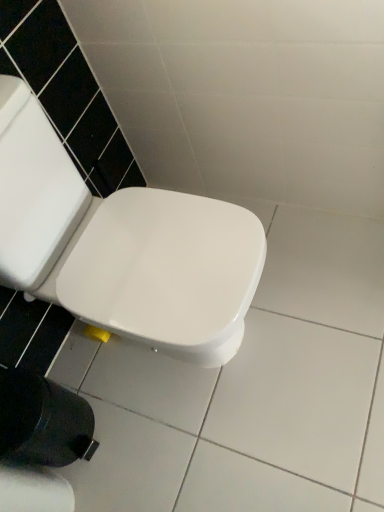
Question: Considering the positions of white glossy toilet seat at center and white paper at lower left in the image, is white glossy toilet seat at center taller or shorter than white paper at lower left?

Choices:
 (A) tall
 (B) short

Answer: (A)

Question: Considering the positions of white glossy toilet seat at center and white paper at lower left in the image, is white glossy toilet seat at center wider or thinner than white paper at lower left?

Choices:
 (A) wide
 (B) thin

Answer: (A)

Question: From a real-world perspective, is white glossy toilet seat at center physically located above or below white paper at lower left?

Choices:
 (A) above
 (B) below

Answer: (A)

Question: Based on their positions, is white paper at lower left located to the left or right of white glossy toilet seat at center?

Choices:
 (A) right
 (B) left

Answer: (B)

Question: Which is correct: white paper at lower left is inside white glossy toilet seat at center, or outside of it?

Choices:
 (A) outside
 (B) inside

Answer: (A)

Question: Considering the positions of white paper at lower left and white glossy toilet seat at center in the image, is white paper at lower left wider or thinner than white glossy toilet seat at center?

Choices:
 (A) wide
 (B) thin

Answer: (B)

Question: From the image's perspective, is white paper at lower left positioned above or below white glossy toilet seat at center?

Choices:
 (A) above
 (B) below

Answer: (B)